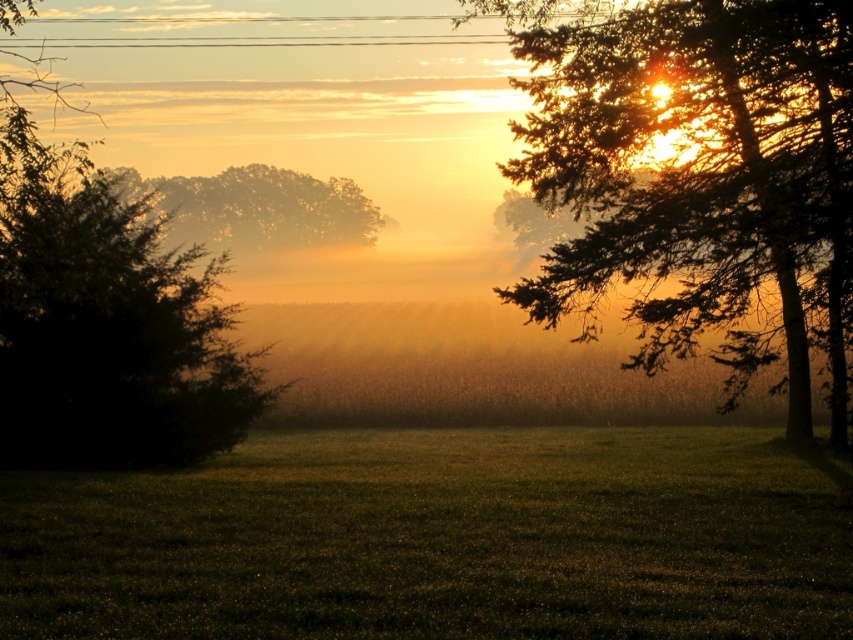
Question: Among these objects, which one is farthest from the camera?

Choices:
 (A) green grassy field at center
 (B) green leafy tree at center
 (C) green leafy tree at left

Answer: (B)

Question: Where is green grassy field at center located in relation to green leafy tree at upper right in the image?

Choices:
 (A) below
 (B) above

Answer: (A)

Question: Among these objects, which one is nearest to the camera?

Choices:
 (A) green leafy tree at left
 (B) green leafy bush at left
 (C) green grassy field at center
 (D) green leafy tree at center

Answer: (C)

Question: Does green leafy bush at left appear under green leafy tree at center?

Choices:
 (A) yes
 (B) no

Answer: (A)

Question: Among these objects, which one is nearest to the camera?

Choices:
 (A) green grassy field at center
 (B) green leafy tree at left
 (C) green leafy bush at left

Answer: (A)

Question: Does green leafy bush at left have a lesser width compared to green leafy tree at center?

Choices:
 (A) yes
 (B) no

Answer: (B)